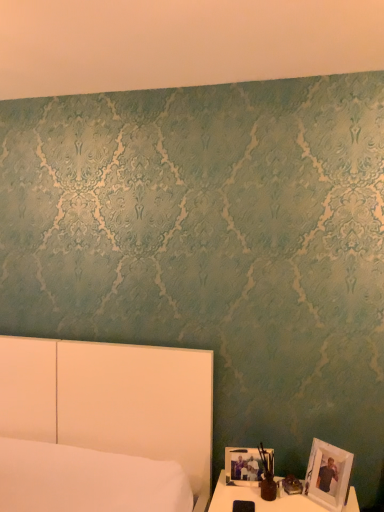
Question: Does white glossy table at lower right have a greater height compared to white matte picture frame at lower right, the second picture frame viewed from the right?

Choices:
 (A) yes
 (B) no

Answer: (A)

Question: Is white glossy table at lower right wider than white matte picture frame at lower right, arranged as the first picture frame when viewed from the left?

Choices:
 (A) yes
 (B) no

Answer: (A)

Question: Is white glossy table at lower right facing away from white matte picture frame at lower right, arranged as the first picture frame when viewed from the left?

Choices:
 (A) no
 (B) yes

Answer: (A)

Question: Is the depth of white glossy table at lower right less than that of white matte picture frame at lower right, the second picture frame viewed from the right?

Choices:
 (A) yes
 (B) no

Answer: (A)

Question: From a real-world perspective, is white glossy table at lower right over white matte picture frame at lower right, the second picture frame viewed from the right?

Choices:
 (A) no
 (B) yes

Answer: (A)

Question: Visually, is white wooden picture frame at lower right, positioned as the second picture frame in left-to-right order, positioned to the left or to the right of white glossy table at lower right?

Choices:
 (A) right
 (B) left

Answer: (A)

Question: Is white wooden picture frame at lower right, positioned as the second picture frame in left-to-right order, bigger or smaller than white glossy table at lower right?

Choices:
 (A) big
 (B) small

Answer: (B)

Question: From their relative heights in the image, would you say white wooden picture frame at lower right, positioned as the second picture frame in left-to-right order, is taller or shorter than white glossy table at lower right?

Choices:
 (A) short
 (B) tall

Answer: (B)

Question: Does point (319, 442) appear closer or farther from the camera than point (220, 508)?

Choices:
 (A) closer
 (B) farther

Answer: (B)

Question: Relative to white wooden picture frame at lower right, positioned as the second picture frame in left-to-right order, is white glossy table at lower right in front or behind?

Choices:
 (A) front
 (B) behind

Answer: (A)

Question: Is white glossy table at lower right wider or thinner than white wooden picture frame at lower right, positioned as the second picture frame in left-to-right order?

Choices:
 (A) thin
 (B) wide

Answer: (B)

Question: Visually, is white glossy table at lower right positioned to the left or to the right of white wooden picture frame at lower right, positioned as the second picture frame in left-to-right order?

Choices:
 (A) right
 (B) left

Answer: (B)

Question: Based on their sizes in the image, would you say white glossy table at lower right is bigger or smaller than white wooden picture frame at lower right, positioned as the second picture frame in left-to-right order?

Choices:
 (A) big
 (B) small

Answer: (A)

Question: Considering their positions, is matte brown vase at lower right located in front of or behind white glossy table at lower right?

Choices:
 (A) front
 (B) behind

Answer: (B)

Question: Considering the positions of matte brown vase at lower right and white glossy table at lower right in the image, is matte brown vase at lower right bigger or smaller than white glossy table at lower right?

Choices:
 (A) small
 (B) big

Answer: (A)